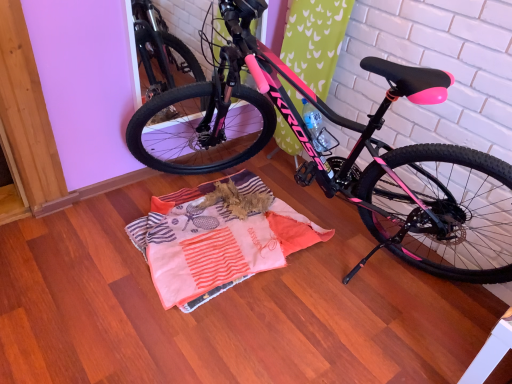
This screenshot has height=384, width=512. I want to click on vacant area that is situated to the right of striped cotton blanket at center, so click(x=362, y=276).